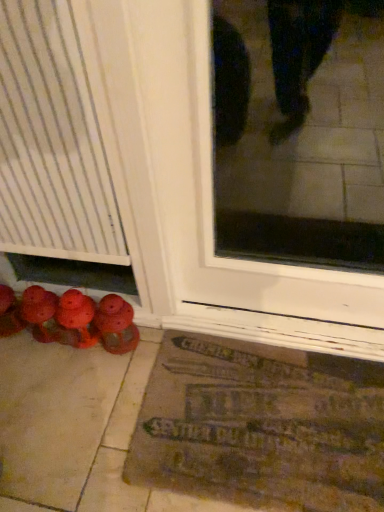
Locate an element on the screen. The height and width of the screenshot is (512, 384). free space in front of matte red shoes at lower left, which appears as the 1th footwear when viewed from the left is located at coordinates (20, 367).